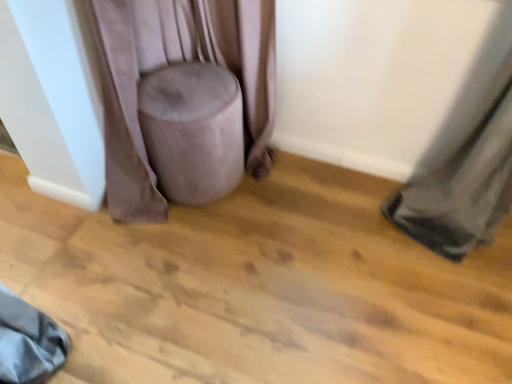
I want to click on free point to the right of velvet beige pouf at center, so click(287, 198).